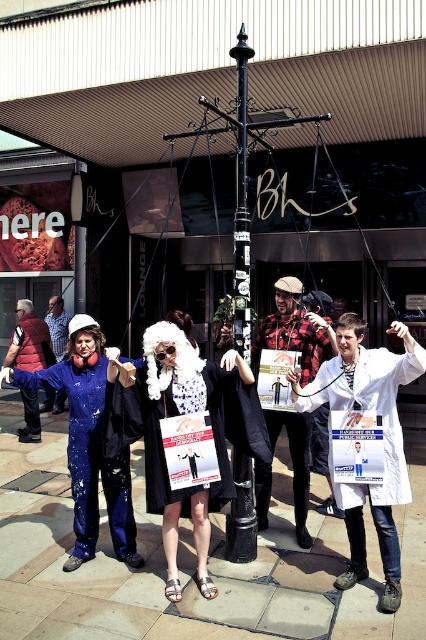
Is white fluffy wig at center shorter than white lab coat at center?

Yes.

Is point (134, 378) farther from camera compared to point (391, 456)?

Yes, point (134, 378) is behind point (391, 456).

This screenshot has height=640, width=426. What are the coordinates of `white fluffy wig at center` in the screenshot? It's located at (184, 417).

Locate an element on the screen. white fluffy wig at center is located at coordinates (184, 417).

Does flannel plaid shirt at center have a greater width compared to black metal pole at center?

Indeed, flannel plaid shirt at center has a greater width compared to black metal pole at center.

Does point (298, 442) come behind point (247, 216)?

Yes.

Image resolution: width=426 pixels, height=640 pixels. I want to click on flannel plaid shirt at center, so click(294, 330).

Is blue paint splattered jumpsuit at left closer to the viewer compared to matte blue jumpsuit at left?

Yes.

Between point (22, 387) and point (63, 308), which one is positioned behind?

Positioned behind is point (63, 308).

Does point (106, 477) lie in front of point (54, 300)?

Yes, point (106, 477) is closer to viewer.

What are the coordinates of `blue paint splattered jumpsuit at left` in the screenshot? It's located at (89, 452).